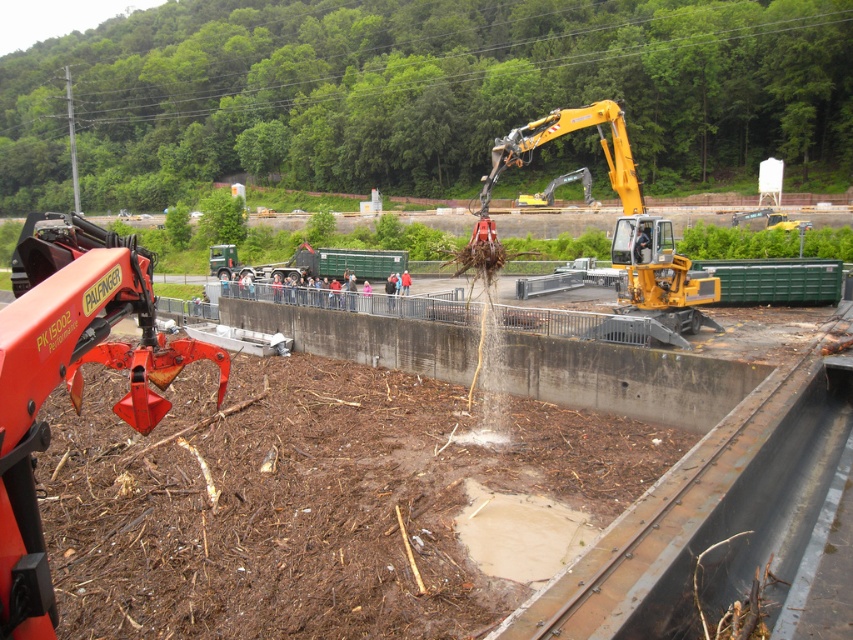
In order to click on orange metallic claw at lower left in this screenshot , I will do `click(68, 378)`.

Looking at this image, does orange metallic claw at lower left have a smaller size compared to yellow metallic excavator at center?

Yes.

Between point (42, 369) and point (651, 220), which one is positioned in front?

Point (42, 369) is more forward.

I want to click on orange metallic claw at lower left, so click(68, 378).

Is brown mulch at center positioned behind yellow metallic excavator at center?

No, brown mulch at center is in front of yellow metallic excavator at center.

Where is `brown mulch at center`? This screenshot has height=640, width=853. brown mulch at center is located at coordinates (653, 420).

Does brown mulch at center appear over orange metallic claw at lower left?

No.

Is brown mulch at center positioned behind orange metallic claw at lower left?

No, brown mulch at center is in front of orange metallic claw at lower left.

Between point (751, 374) and point (21, 509), which one is positioned in front?

Point (21, 509) is more forward.

Find the location of a particular element. This screenshot has width=853, height=640. brown mulch at center is located at coordinates (653, 420).